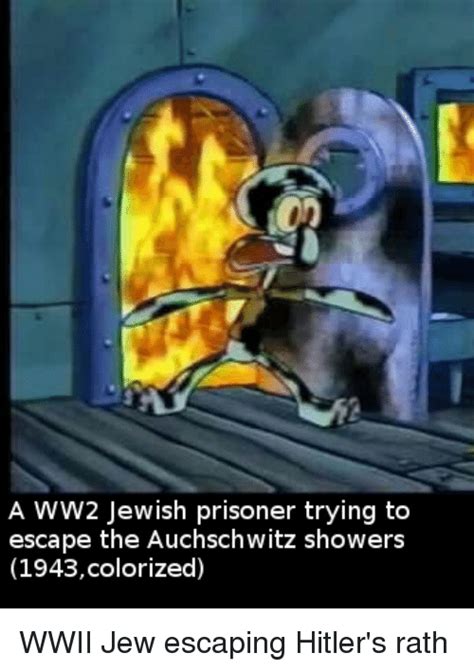
Identify the location of kitchen. This screenshot has height=671, width=474. (439, 335).